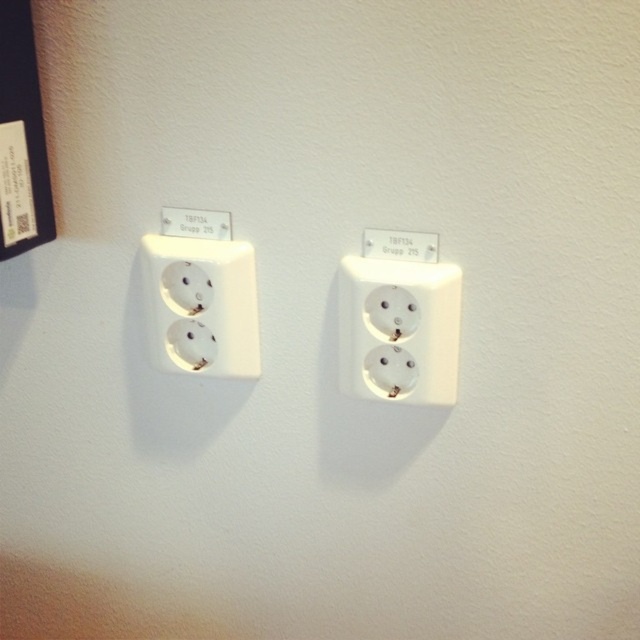
Question: Can you confirm if white plastic outlet at center is positioned above white plastic outlet at left?

Choices:
 (A) no
 (B) yes

Answer: (A)

Question: Is white plastic outlet at center bigger than white plastic outlet at left?

Choices:
 (A) no
 (B) yes

Answer: (B)

Question: Among these objects, which one is nearest to the camera?

Choices:
 (A) white plastic outlet at left
 (B) white plastic outlet at center

Answer: (B)

Question: Which point is farther from the camera taking this photo?

Choices:
 (A) (376, 369)
 (B) (198, 323)

Answer: (B)

Question: Which point appears closest to the camera in this image?

Choices:
 (A) [x=241, y=348]
 (B) [x=374, y=342]

Answer: (B)

Question: Considering the relative positions of white plastic outlet at center and white plastic outlet at left in the image provided, where is white plastic outlet at center located with respect to white plastic outlet at left?

Choices:
 (A) above
 (B) below

Answer: (B)